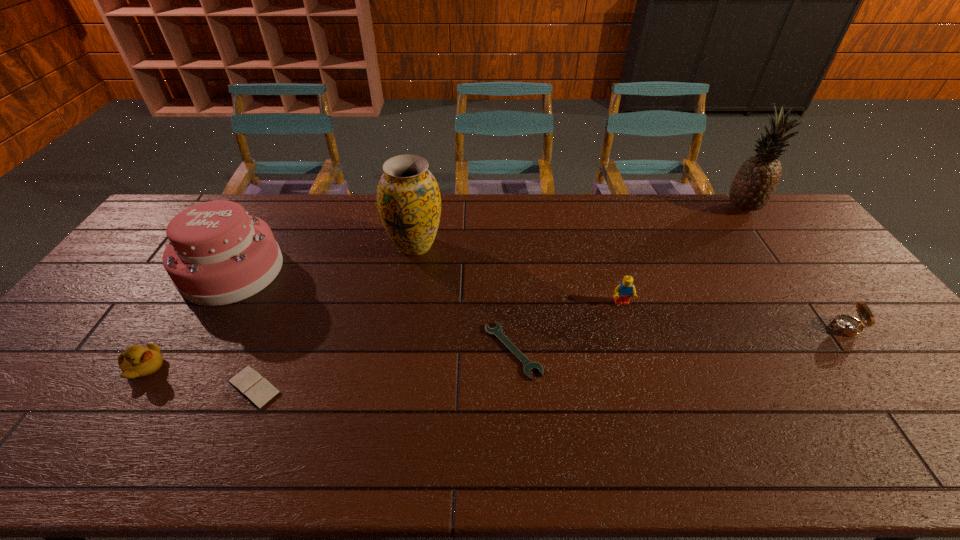
This screenshot has width=960, height=540. What are the coordinates of `the farthest object` in the screenshot? It's located at (754, 184).

Locate an element on the screen. This screenshot has height=540, width=960. pineapple is located at coordinates (754, 184).

The width and height of the screenshot is (960, 540). I want to click on the fifth object from right to left, so click(x=408, y=197).

Locate an element on the screen. vase is located at coordinates (408, 197).

Where is `the sixth shortest object`? Image resolution: width=960 pixels, height=540 pixels. the sixth shortest object is located at coordinates (217, 254).

Identify the location of the third object from right to left. The width and height of the screenshot is (960, 540). (623, 292).

The image size is (960, 540). I want to click on compass, so click(x=847, y=325).

You are a GUI agent. You are given a task and a screenshot of the screen. Output one action in this format:
    pyautogui.click(x=<x>, y=<y>)
    Task: Click on the duckling
    This screenshot has width=960, height=540.
    Given the screenshot: What is the action you would take?
    pyautogui.click(x=137, y=361)

Locate an element on the screen. the second shortest object is located at coordinates (250, 383).

Locate an element on the screen. The image size is (960, 540). the fifth object from left to right is located at coordinates (528, 365).